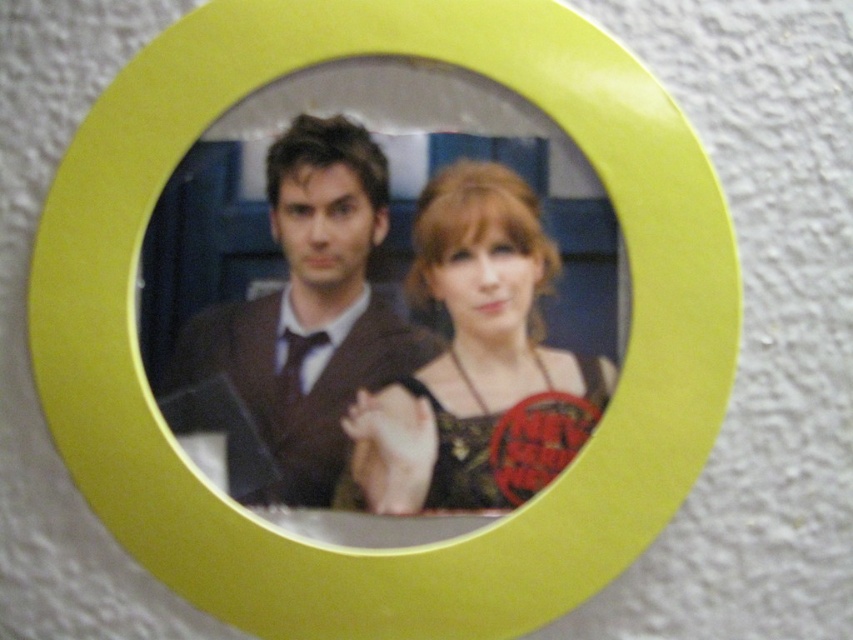
You are an interior designer evaluating the placement of two framed artworks on a wall. The first artwork is a circular photo with a bright yellow border, showing a woman in a matte black dress at center and a man in a matte brown suit at center. The second artwork is a rectangular abstract painting with bold geometric shapes. You want to hang the abstract painting so that it does not block either of the two central figures in the circular photo. Based on the spatial arrangement in the photo, where should

The matte black dress at center is in front of the matte brown suit at center. Therefore, to avoid blocking either figure, the abstract painting should be placed either above the circular photo, below it, or to the side, ensuring it does not overlap the central area where both figures are positioned.

You are hanging a new picture on the wall next to the framed photograph. The new picture is 10 cm tall. The matte black dress at center and the matte brown suit at center are part of the existing photo. Which object in the photo is taller so that you can align the new picture accordingly?

The matte brown suit at center is taller than the matte black dress at center, so you should align the new 10 cm tall picture with the height of the matte brown suit at center to ensure proper alignment.

You are an interior designer assessing the wall decor. You notice the matte black dress at center and the matte brown suit at center in the photograph. Which object in the photo appears taller?

The matte brown suit at center appears taller than the matte black dress at center.